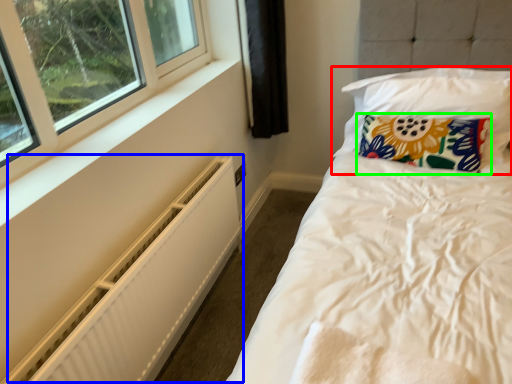
Question: Estimate the real-world distances between objects in this image. Which object is farther from pillow (highlighted by a red box), radiator (highlighted by a blue box) or pillow (highlighted by a green box)?

Choices:
 (A) radiator
 (B) pillow

Answer: (A)